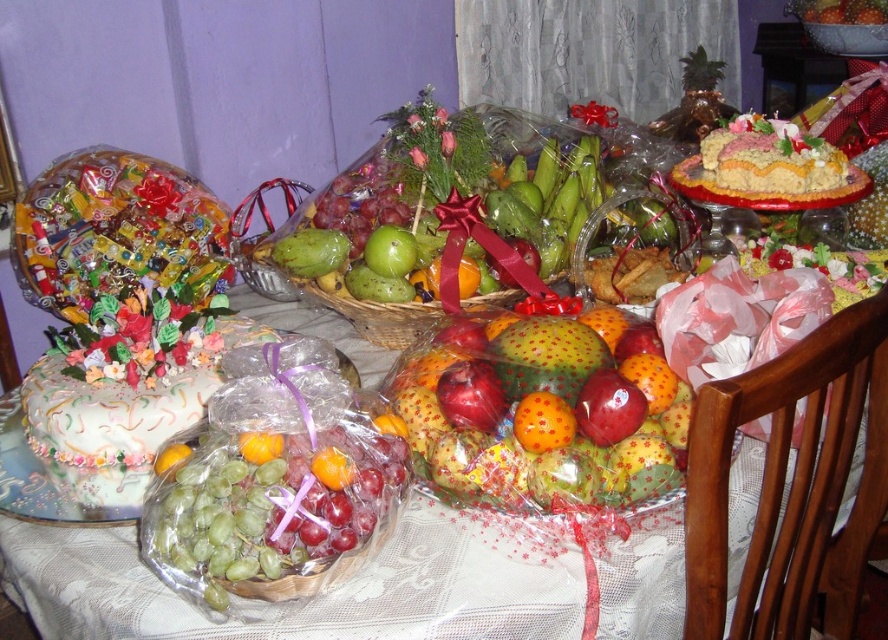
Is white frosted cake at lower left to the left of matte yellow cake at upper right from the viewer's perspective?

Correct, you'll find white frosted cake at lower left to the left of matte yellow cake at upper right.

Can you confirm if white frosted cake at lower left is positioned below matte yellow cake at upper right?

Yes.

Find the location of `white frosted cake at lower left`. white frosted cake at lower left is located at coordinates [x=123, y=413].

At what (x,y) coordinates should I click in order to perform the action: click on white frosted cake at lower left. Please return your answer as a coordinate pair (x, y). Looking at the image, I should click on (123, 413).

Is speckled green mango at center to the right of white frosted cake at lower left from the viewer's perspective?

Indeed, speckled green mango at center is positioned on the right side of white frosted cake at lower left.

Can you confirm if speckled green mango at center is smaller than white frosted cake at lower left?

Yes, speckled green mango at center is smaller than white frosted cake at lower left.

Identify the location of speckled green mango at center. Image resolution: width=888 pixels, height=640 pixels. (538, 412).

Identify the location of speckled green mango at center. (538, 412).

Who is taller, speckled green mango at center or matte yellow cake at upper right?

matte yellow cake at upper right

Between speckled green mango at center and matte yellow cake at upper right, which one is positioned lower?

speckled green mango at center

This screenshot has width=888, height=640. What do you see at coordinates (538, 412) in the screenshot?
I see `speckled green mango at center` at bounding box center [538, 412].

Where is `speckled green mango at center`? The width and height of the screenshot is (888, 640). speckled green mango at center is located at coordinates (538, 412).